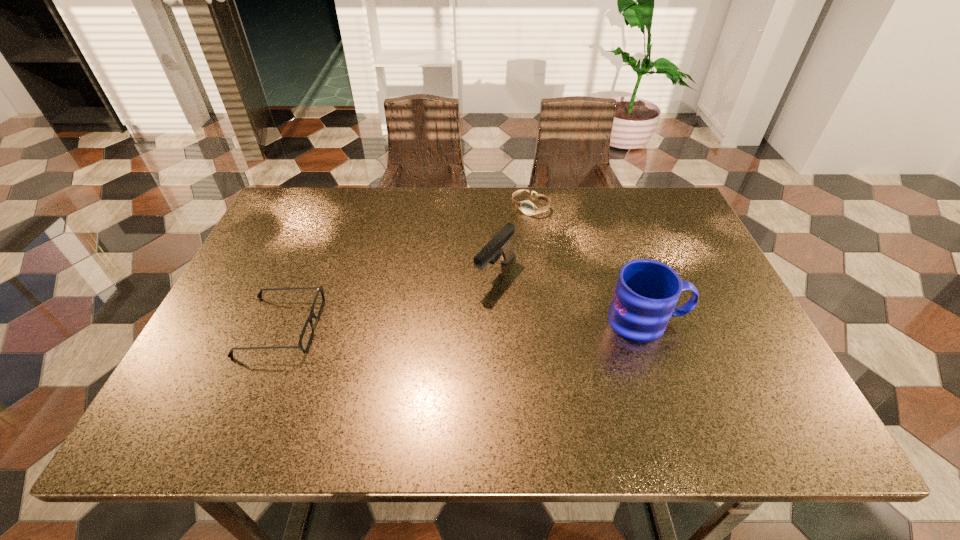
This screenshot has width=960, height=540. I want to click on vacant space on the desktop that is between the leftmost object and the mug and is positioned on the face of the third object from left to right, so click(425, 324).

This screenshot has height=540, width=960. Find the location of `free space on the desktop that is between the leftmost object and the tallest object and is positioned on the front-facing side of the second tallest object`. free space on the desktop that is between the leftmost object and the tallest object and is positioned on the front-facing side of the second tallest object is located at coordinates (450, 324).